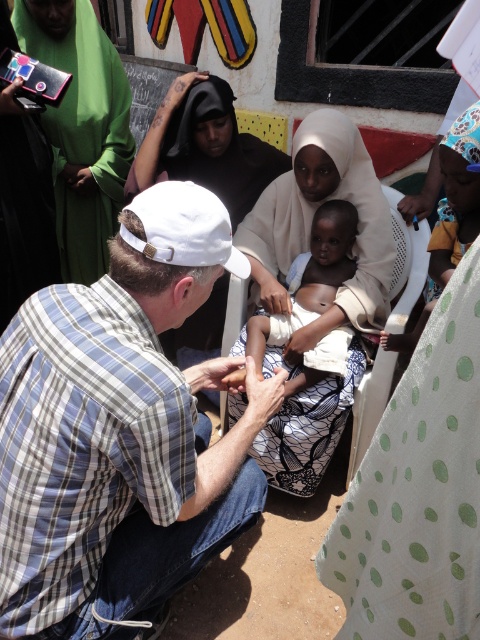
Does plaid cotton shirt at center have a smaller size compared to light skin baby at center?

Incorrect, plaid cotton shirt at center is not smaller in size than light skin baby at center.

Is point (51, 449) positioned in front of point (245, 349)?

That is True.

Find the location of `plaid cotton shirt at center`. plaid cotton shirt at center is located at coordinates (117, 419).

Who is positioned more to the right, white lace dress at center or light skin baby at center?

Positioned to the right is light skin baby at center.

Which is more to the left, white lace dress at center or light skin baby at center?

Positioned to the left is white lace dress at center.

Find the location of a particular element. This screenshot has height=640, width=480. white lace dress at center is located at coordinates (312, 216).

Does plaid cotton shirt at center appear on the right side of white lace dress at center?

In fact, plaid cotton shirt at center is to the left of white lace dress at center.

Does plaid cotton shirt at center appear under white lace dress at center?

Yes, plaid cotton shirt at center is below white lace dress at center.

You are a GUI agent. You are given a task and a screenshot of the screen. Output one action in this format:
    pyautogui.click(x=<x>, y=<y>)
    Task: Click on the plaid cotton shirt at center
    This screenshot has height=640, width=480.
    Given the screenshot: What is the action you would take?
    pyautogui.click(x=117, y=419)